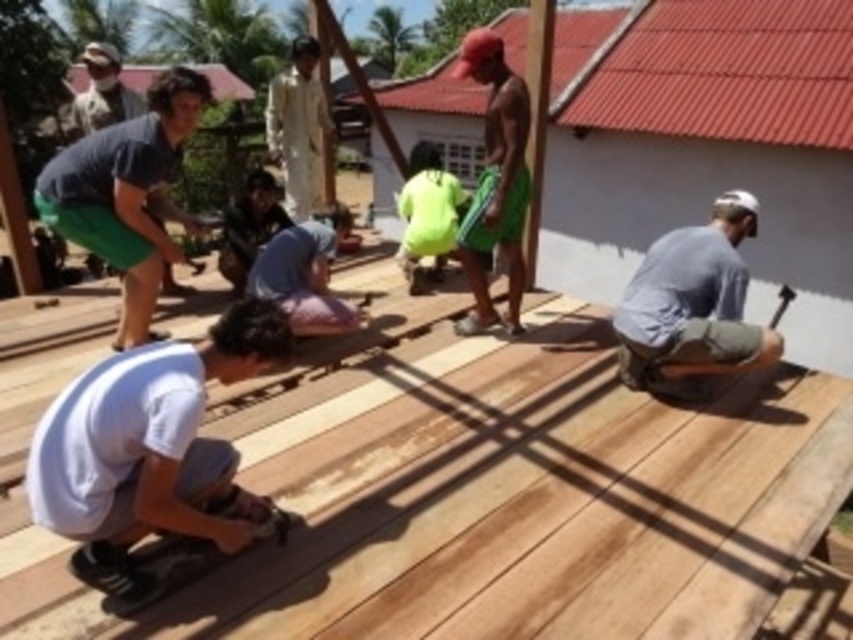
You are a contractor assessing the deck construction site. You notice the light brown wood at center and the matte blue shirt at upper left. Which object is positioned higher in the image?

The light brown wood at center is much taller than the matte blue shirt at upper left, so it is positioned higher in the image.

You are standing at the point marked as point (291, 177) and want to reach the other side of the deck. The deck is 25.50 feet wide. If your ladder is 20 feet long, will it be long enough to cross the deck safely?

The deck is 25.50 feet wide, and your ladder is only 20 feet long, so it will not be long enough to safely cross the deck.